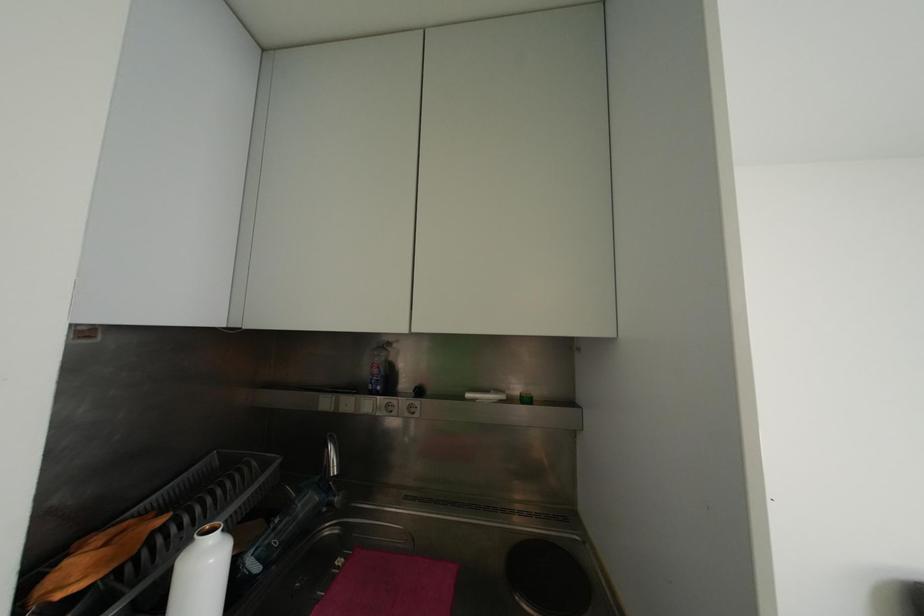
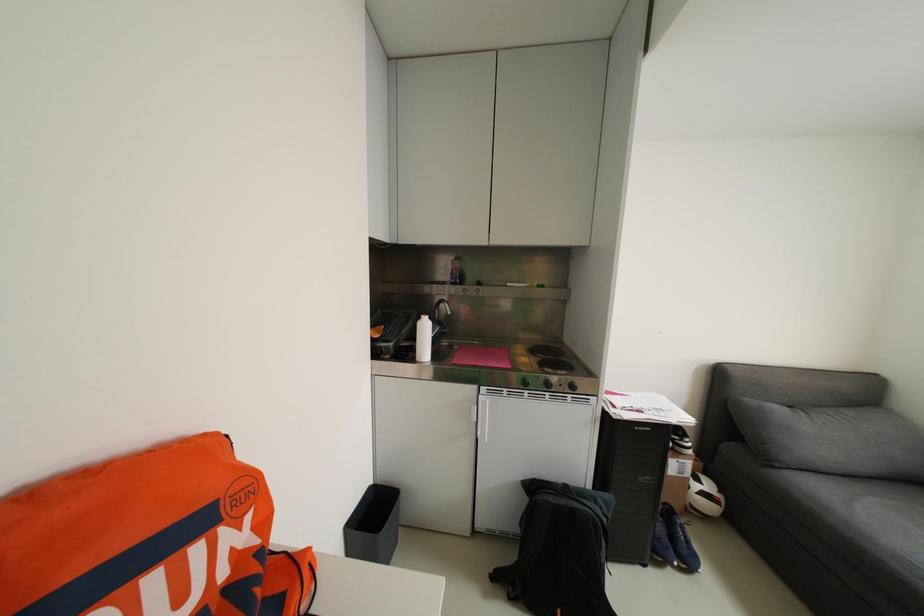
Question: The first image is from the beginning of the video and the second image is from the end. How did the camera likely rotate when shooting the video?

Choices:
 (A) Left
 (B) Right
 (C) Up
 (D) Down

Answer: (D)